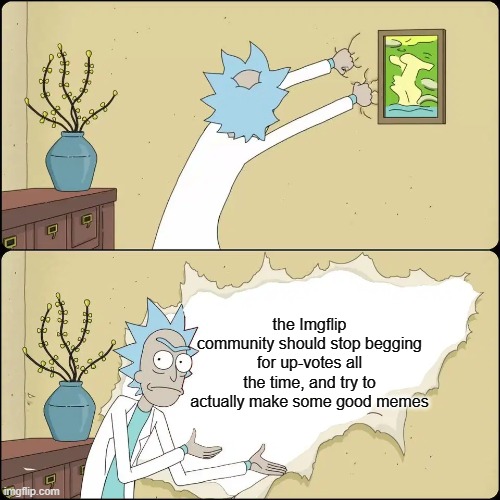
Identify the location of upper screen brown bureau. (54, 204).